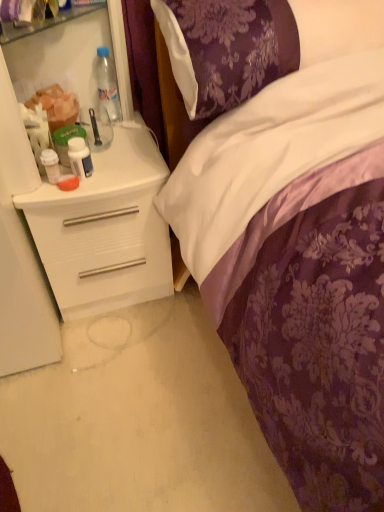
You are a GUI agent. You are given a task and a screenshot of the screen. Output one action in this format:
    pyautogui.click(x=<x>, y=<y>)
    Task: Click on the free space above white plastic desk at left (from a real-world perspective)
    The image size is (384, 512).
    Given the screenshot: What is the action you would take?
    pyautogui.click(x=109, y=148)